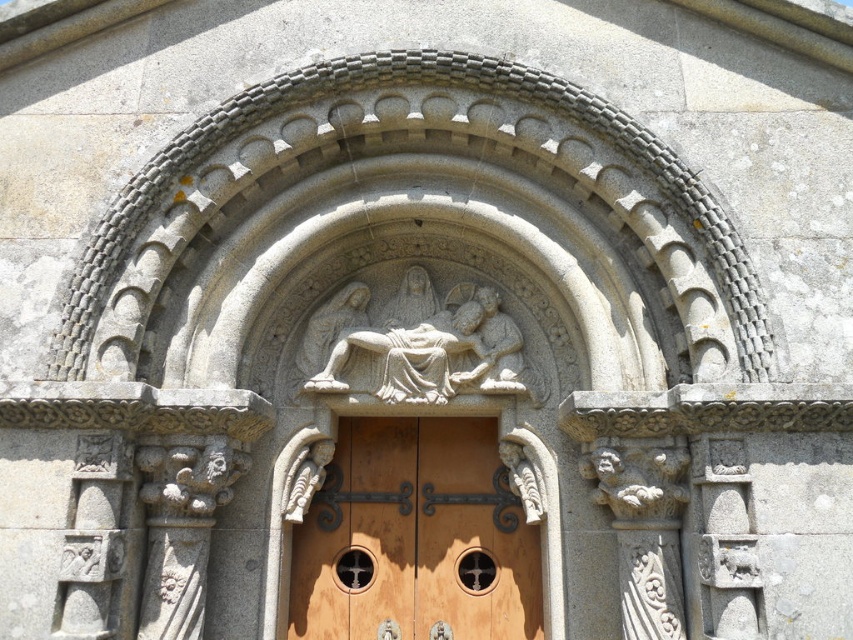
Does wooden door at center appear on the right side of gray stone carving at center?

No, wooden door at center is not to the right of gray stone carving at center.

Which of these two, wooden door at center or gray stone carving at center, stands taller?

wooden door at center is taller.

Does point (370, 624) lie behind point (460, 291)?

No.

The width and height of the screenshot is (853, 640). I want to click on wooden door at center, so click(415, 536).